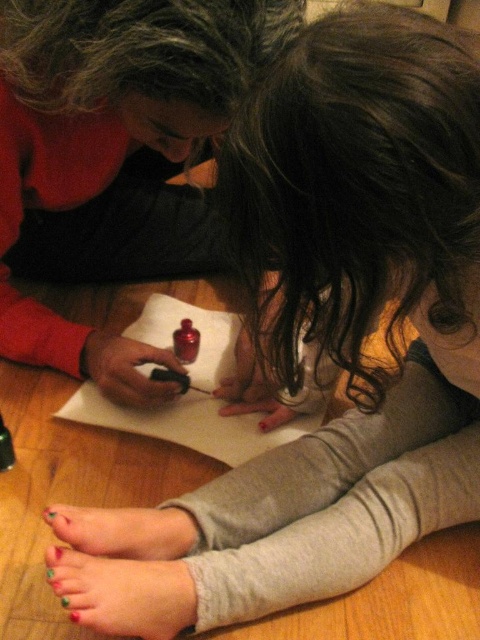
You are an artist trying to decide whether to place the dark curly hair at center or the matte black crayon at center on a narrow shelf. Which object can fit better on the shelf if the shelf is only wide enough for the narrower of the two?

The matte black crayon at center is narrower than the dark curly hair at center, so it can fit better on the narrow shelf.